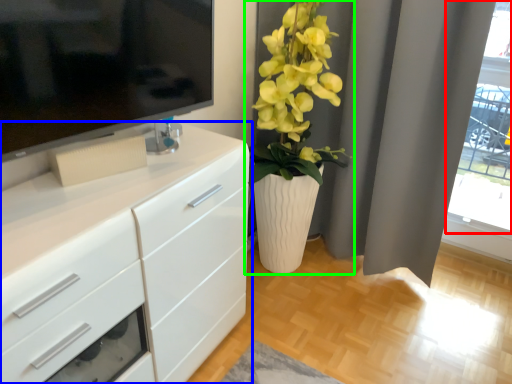
Question: Based on their relative distances, which object is farther from glass door (highlighted by a red box)? Choose from chest of drawers (highlighted by a blue box) and houseplant (highlighted by a green box).

Choices:
 (A) chest of drawers
 (B) houseplant

Answer: (A)